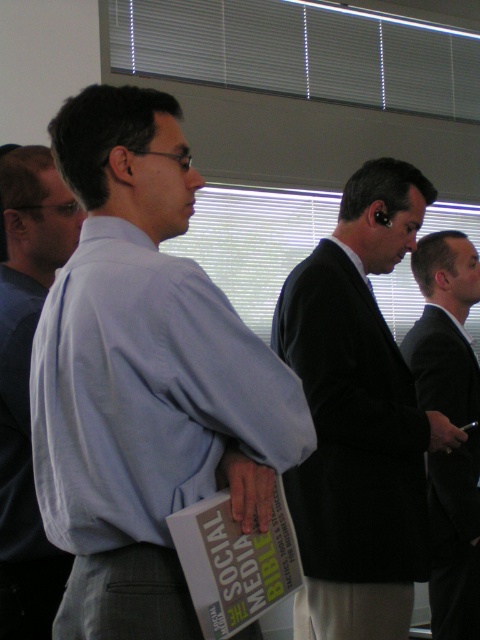
Question: Does black suit at right appear under black silk tie at center?

Choices:
 (A) no
 (B) yes

Answer: (B)

Question: Does dark suit at center have a smaller size compared to light blue shirt at left?

Choices:
 (A) no
 (B) yes

Answer: (A)

Question: Which of the following is the closest to the observer?

Choices:
 (A) black matte suit at center
 (B) black silk tie at center
 (C) light blue shirt at left

Answer: (C)

Question: Can you confirm if dark suit at center is smaller than black matte suit at center?

Choices:
 (A) yes
 (B) no

Answer: (A)

Question: Which of these objects is positioned closest to the light blue shirt at left?

Choices:
 (A) white plastic blinds at upper center
 (B) black silk tie at center

Answer: (B)

Question: Which point is closer to the camera?

Choices:
 (A) (455, 88)
 (B) (11, 444)
 (C) (414, 332)

Answer: (B)